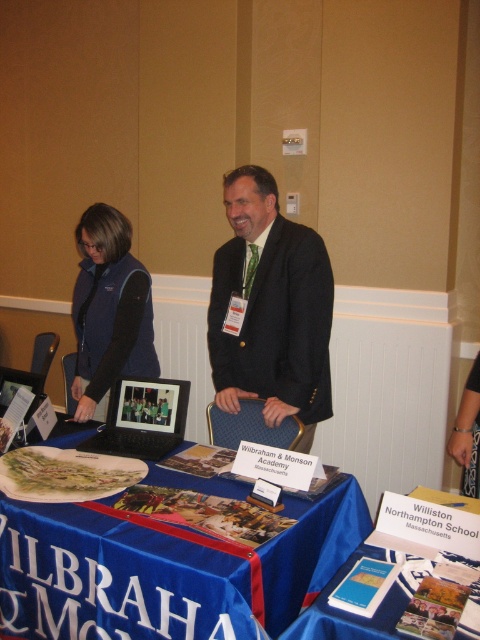
You are a visitor at the fair and want to know which item on the table is taller between the matte blue vest at center and the black matte laptop at center. Can you tell me?

The matte blue vest at center is taller than the black matte laptop at center.

You are standing at the origin point in the image. The dark suit at center is located at coordinates point (x=271, y=308). If you want to approach the dark suit at center, which direction should you move from the origin?

The dark suit at center is located at coordinates point (x=271, y=308), so you should move towards that coordinate point to approach the dark suit at center.